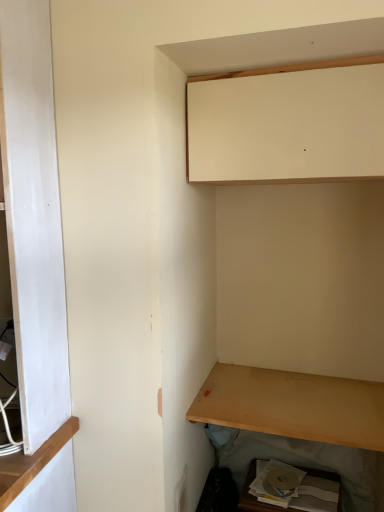
Where is `vacant area situated below matte white cabinet at upper center, the 1th cabinetry viewed from the top (from a real-world perspective)`? The height and width of the screenshot is (512, 384). vacant area situated below matte white cabinet at upper center, the 1th cabinetry viewed from the top (from a real-world perspective) is located at coordinates (296, 392).